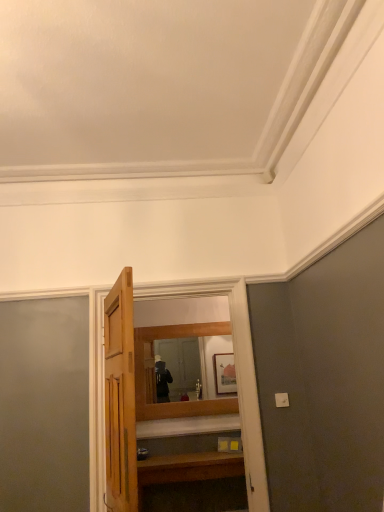
Measure the distance between wooden vanity at lower center and camera.

The distance of wooden vanity at lower center from camera is 3.73 meters.

This screenshot has width=384, height=512. In order to click on wooden door at center in this screenshot , I will do `click(120, 397)`.

This screenshot has height=512, width=384. I want to click on wooden mirror at center, so [x=149, y=376].

Could you tell me if wooden door at center is turned towards wooden mirror at center?

No, wooden door at center is not turned towards wooden mirror at center.

From a real-world perspective, which is physically below, wooden door at center or wooden mirror at center?

wooden door at center is physically lower.

Measure the distance from wooden door at center to wooden mirror at center.

They are 1.69 meters apart.

Locate an element on the screen. The image size is (384, 512). mirror behind the wooden door at center is located at coordinates (149, 376).

In the image, is wooden mirror at center positioned in front of or behind wooden door at center?

wooden mirror at center is behind wooden door at center.

Based on the photo, from a real-world perspective, between wooden mirror at center and wooden door at center, who is vertically higher?

wooden mirror at center.

From the image's perspective, is wooden mirror at center over wooden door at center?

Incorrect, from the image's perspective, wooden mirror at center is lower than wooden door at center.

Which of these two, wooden mirror at center or wooden vanity at lower center, is smaller?

Smaller between the two is wooden mirror at center.

Is wooden mirror at center looking in the opposite direction of wooden vanity at lower center?

wooden mirror at center is not turned away from wooden vanity at lower center.

From a real-world perspective, is wooden mirror at center on wooden vanity at lower center?

Yes.

Based on the photo, measure the distance from wooden mirror at center to wooden vanity at lower center.

They are 22.80 inches apart.

Can you confirm if wooden door at center is bigger than wooden vanity at lower center?

Indeed, wooden door at center has a larger size compared to wooden vanity at lower center.

Which is closer to the camera, (124, 489) or (157, 508)?

Clearly, point (124, 489) is closer to the camera than point (157, 508).

Is wooden vanity at lower center at the back of wooden door at center?

wooden door at center does not have its back to wooden vanity at lower center.

Is point (234, 458) closer or farther from the camera than point (117, 376)?

Point (234, 458) is farther from the camera than point (117, 376).

Is wooden vanity at lower center shorter than wooden door at center?

Indeed, wooden vanity at lower center has a lesser height compared to wooden door at center.

From a real-world perspective, which is physically above, wooden vanity at lower center or wooden door at center?

wooden door at center.

How different are the orientations of wooden vanity at lower center and wooden door at center in degrees?

103 degrees separate the facing orientations of wooden vanity at lower center and wooden door at center.

Is wooden vanity at lower center touching wooden mirror at center?

No, wooden vanity at lower center is not touching wooden mirror at center.

Who is more distant, wooden vanity at lower center or wooden mirror at center?

wooden mirror at center is behind.

How many degrees apart are the facing directions of wooden vanity at lower center and wooden mirror at center?

0.337 degrees.

Can you confirm if wooden vanity at lower center is positioned to the right of wooden mirror at center?

Yes, wooden vanity at lower center is to the right of wooden mirror at center.

The width and height of the screenshot is (384, 512). Identify the location of door that is on the left side of wooden mirror at center. pos(120,397).

Where is `mirror behind the wooden door at center`? This screenshot has height=512, width=384. mirror behind the wooden door at center is located at coordinates (149, 376).

When comparing their distances from wooden mirror at center, does wooden door at center or wooden vanity at lower center seem further?

Based on the image, wooden door at center appears to be further to wooden mirror at center.

Looking at the image, which one is located further to wooden vanity at lower center, wooden door at center or wooden mirror at center?

Based on the image, wooden door at center appears to be further to wooden vanity at lower center.

Looking at the image, which one is located closer to wooden vanity at lower center, wooden mirror at center or wooden door at center?

wooden mirror at center.

When comparing their distances from wooden door at center, does wooden vanity at lower center or wooden mirror at center seem closer?

Among the two, wooden vanity at lower center is located nearer to wooden door at center.

Based on the photo, considering their positions, is wooden vanity at lower center positioned further to wooden mirror at center than wooden door at center?

Based on the image, wooden door at center appears to be further to wooden mirror at center.

When comparing their distances from wooden door at center, does wooden mirror at center or wooden vanity at lower center seem further?

The object further to wooden door at center is wooden mirror at center.

This screenshot has width=384, height=512. Identify the location of vanity between wooden door at center and wooden mirror at center from front to back. (190, 475).